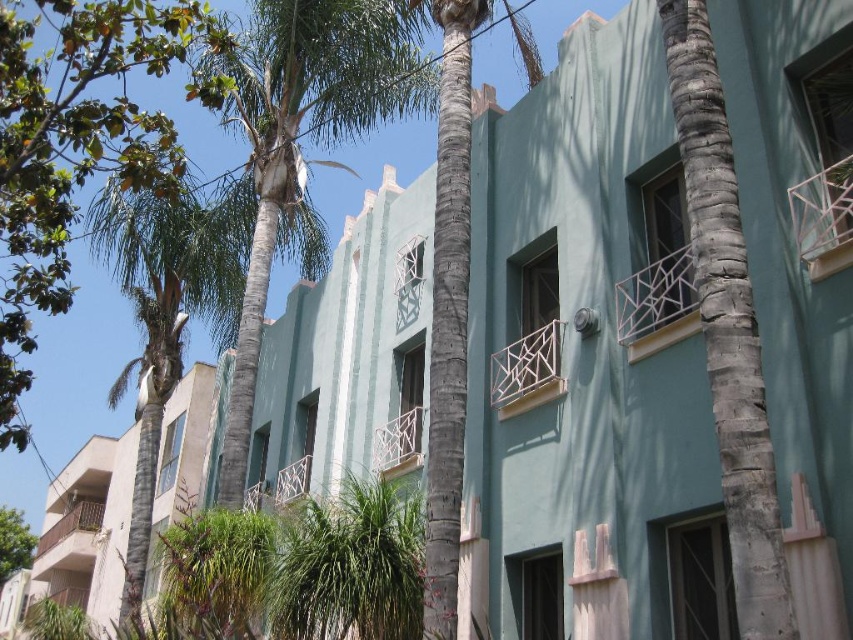
Is green leafy palm tree at upper left closer to camera compared to green leafy tree at lower left?

Yes, green leafy palm tree at upper left is closer to the viewer.

Who is more distant from viewer, (88, 125) or (6, 576)?

Positioned behind is point (6, 576).

At what (x,y) coordinates should I click in order to perform the action: click on green leafy palm tree at upper left. Please return your answer as a coordinate pair (x, y). The image size is (853, 640). Looking at the image, I should click on (74, 145).

Can you confirm if gray textured palm tree at center is positioned to the right of beige concrete building at left?

Correct, you'll find gray textured palm tree at center to the right of beige concrete building at left.

Is gray textured palm tree at center positioned in front of beige concrete building at left?

Yes.

At what (x,y) coordinates should I click in order to perform the action: click on gray textured palm tree at center. Please return your answer as a coordinate pair (x, y). Looking at the image, I should click on (727, 324).

Consider the image. Does green leafy palm tree at upper left have a larger size compared to gray textured palm tree at center?

Yes.

Is point (57, 140) closer to camera compared to point (738, 268)?

No, (57, 140) is further to viewer.

Find the location of `green leafy palm tree at upper left`. green leafy palm tree at upper left is located at coordinates (74, 145).